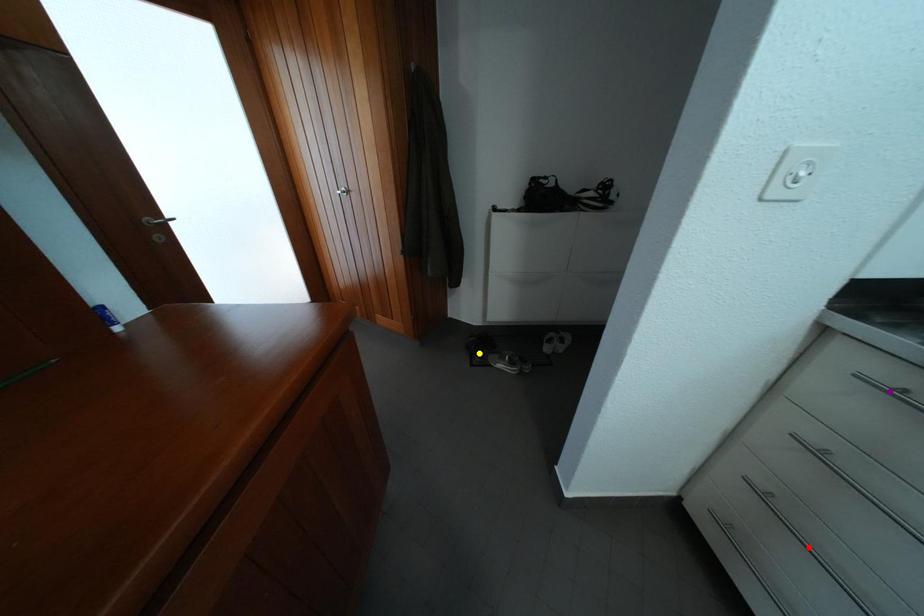
Order these from nearest to farthest:
A) purple point
B) red point
C) yellow point

1. purple point
2. red point
3. yellow point